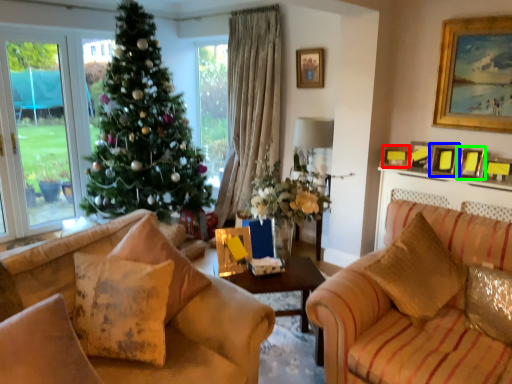
Question: Considering the real-world distances, which object is farthest from picture frame (highlighted by a red box)? picture frame (highlighted by a blue box) or picture frame (highlighted by a green box)?

Choices:
 (A) picture frame
 (B) picture frame

Answer: (B)